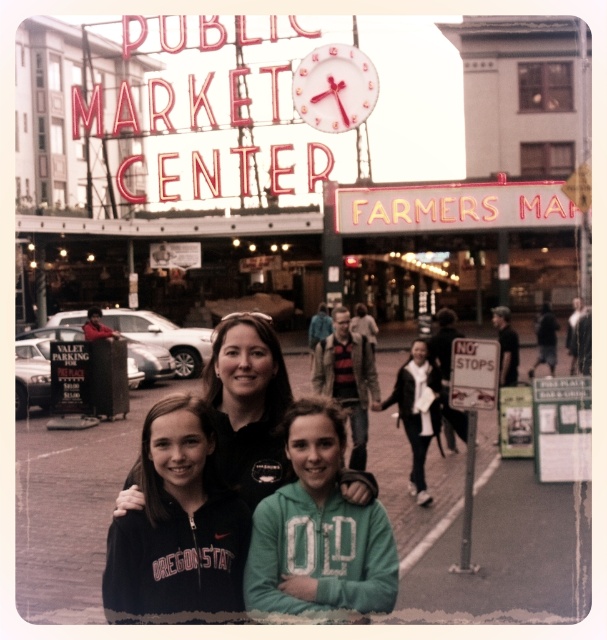
Question: Which of the following is the farthest from the observer?

Choices:
 (A) (185, 524)
 (B) (268, 412)

Answer: (B)

Question: Estimate the real-world distances between objects in this image. Which object is closer to the green paper sign at right?

Choices:
 (A) white glossy clock at upper center
 (B) no stops" sign at lower right
 (C) white matte jacket at center

Answer: (B)

Question: Can you confirm if green paper sign at right is wider than no stops" sign at lower right?

Choices:
 (A) yes
 (B) no

Answer: (A)

Question: Among these points, which one is nearest to the camera?

Choices:
 (A) (215, 396)
 (B) (489, 356)

Answer: (A)

Question: Is neon sign at center closer to the viewer compared to white glossy clock at upper center?

Choices:
 (A) no
 (B) yes

Answer: (B)

Question: Is black fleece jacket at center smaller than neon sign at center?

Choices:
 (A) yes
 (B) no

Answer: (B)